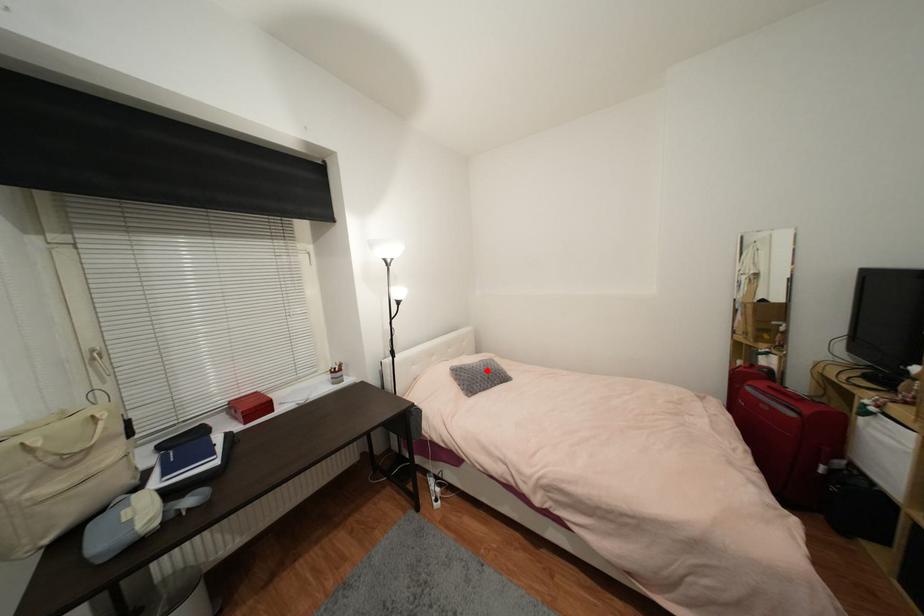
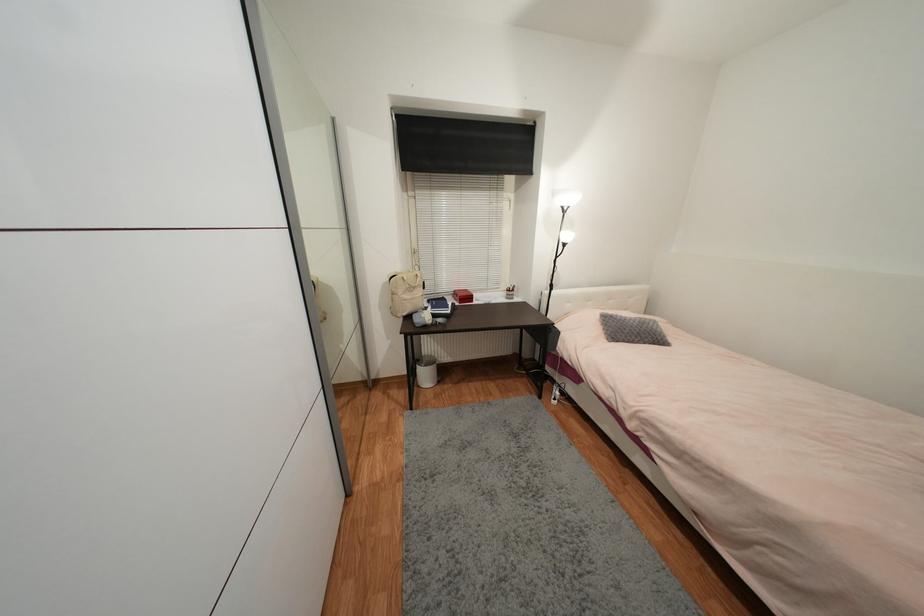
Question: I am providing you with two images of the same scene from different viewpoints. Image1 has a red point marked. In image2, the corresponding 3D location appears at what relative position? Reply with the corresponding letter.

Choices:
 (A) Closer
 (B) Farther

Answer: (B)